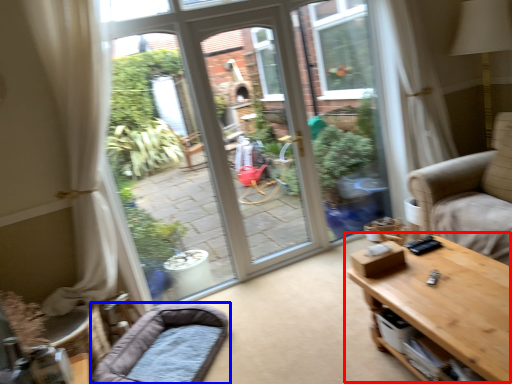
Question: Among these objects, which one is nearest to the camera, table (highlighted by a red box) or dog bed (highlighted by a blue box)?

Choices:
 (A) table
 (B) dog bed

Answer: (A)